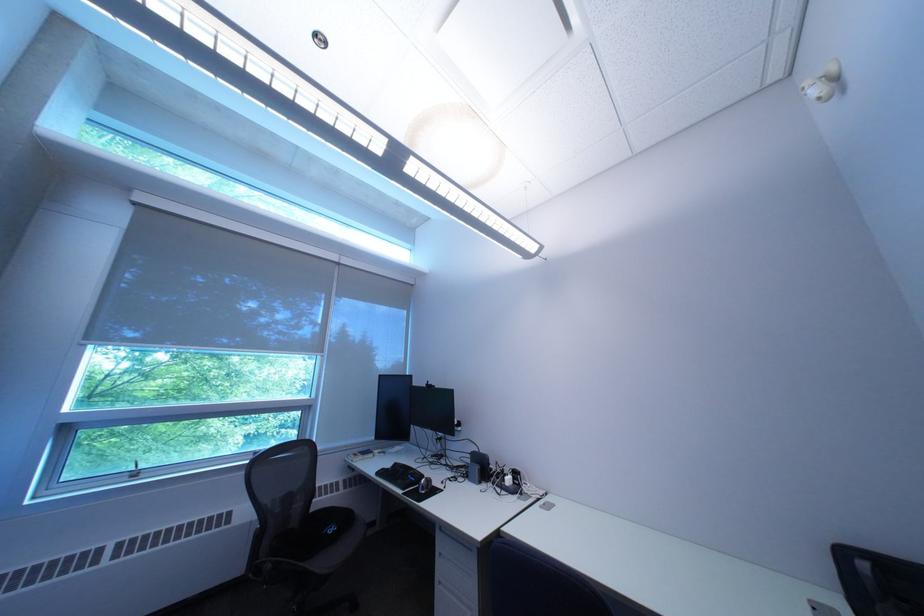
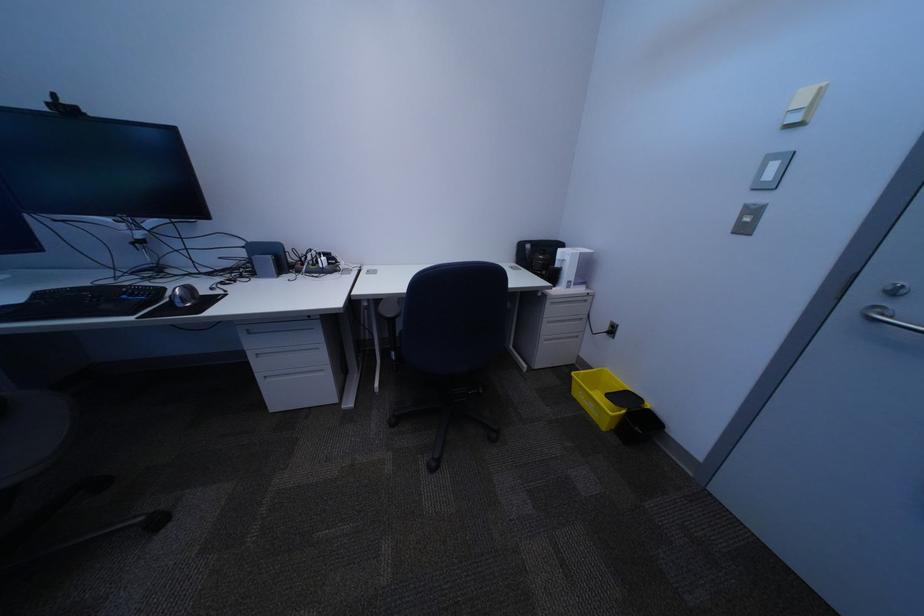
Based on the continuous images, in which direction is the camera rotating?

The camera's rotation is toward right-down.